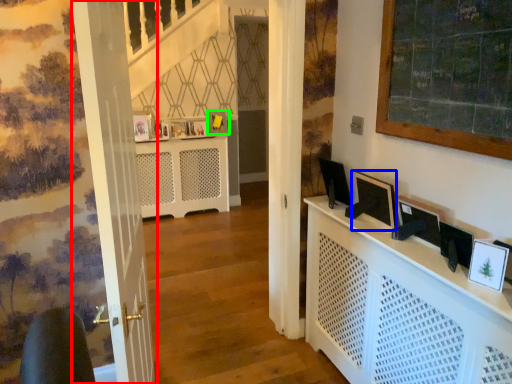
Question: Which is nearer to the door (highlighted by a red box)? computer monitor (highlighted by a blue box) or picture frame (highlighted by a green box).

Choices:
 (A) computer monitor
 (B) picture frame

Answer: (A)